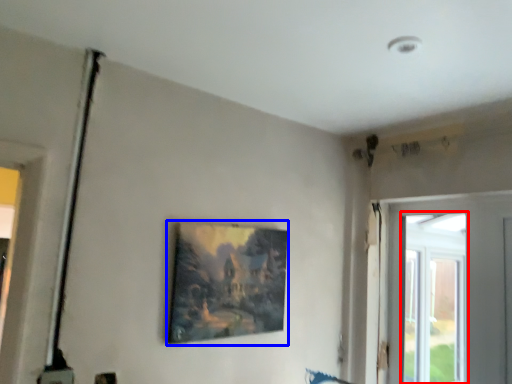
Question: Which of the following is the closest to the observer, window (highlighted by a red box) or picture frame (highlighted by a blue box)?

Choices:
 (A) window
 (B) picture frame

Answer: (B)